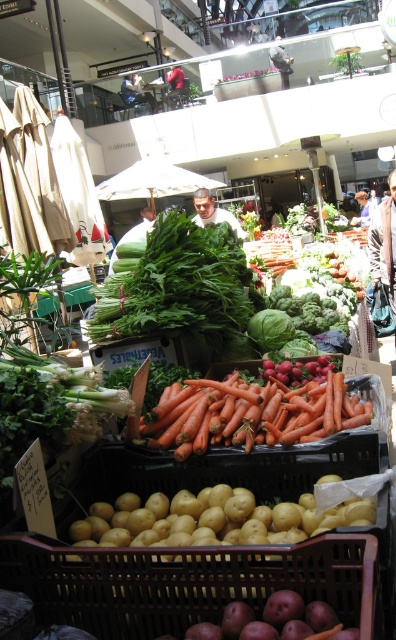
Question: Does green leafy at center have a greater width compared to orange smooth carrots at center?

Choices:
 (A) no
 (B) yes

Answer: (B)

Question: Observing the image, what is the correct spatial positioning of orange smooth carrots at center in reference to smooth brown hair at center?

Choices:
 (A) above
 (B) below

Answer: (B)

Question: Which point appears closest to the camera in this image?

Choices:
 (A) (215, 276)
 (B) (194, 218)

Answer: (A)

Question: Which of the following is the closest to the observer?

Choices:
 (A) green leafy at center
 (B) red fabric jacket at center
 (C) light blue shirt at center
 (D) orange smooth carrots at center

Answer: (D)

Question: Is orange smooth carrots at center wider than light blue shirt at center?

Choices:
 (A) yes
 (B) no

Answer: (B)

Question: Which point appears farthest from the camera in this image?

Choices:
 (A) (192, 424)
 (B) (367, 198)

Answer: (B)